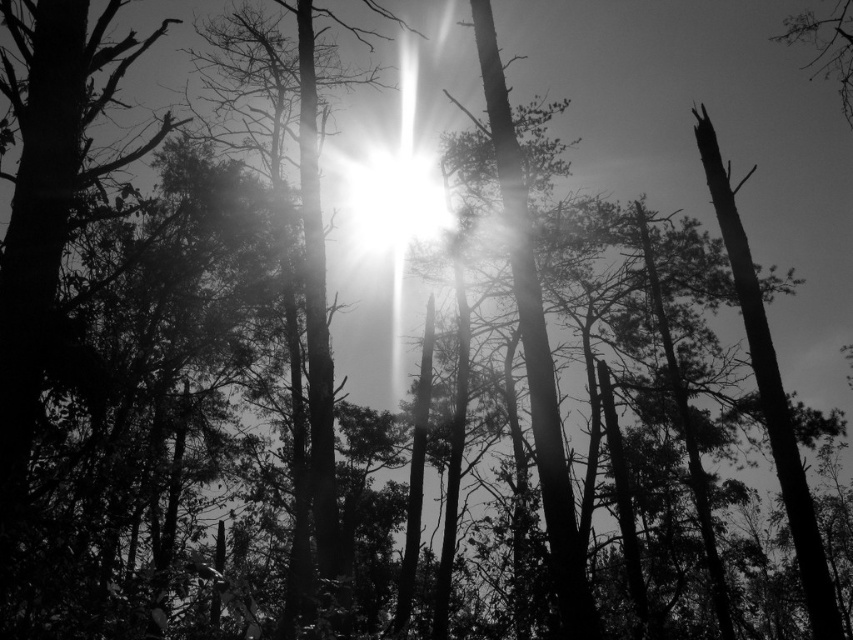
You are standing in the forest scene shown in the image. You want to touch the smooth dark wood tree trunk at right. Which direction should you move to reach it?

You should move to the right because the smooth dark wood tree trunk at right is located at point [770,392], which is on the right side of the image.

You are a photographer analyzing the composition of this black and white forest image. You notice a point at coordinates (770,392). What object is located at this point?

The smooth dark wood tree trunk at right is located at point (770,392).